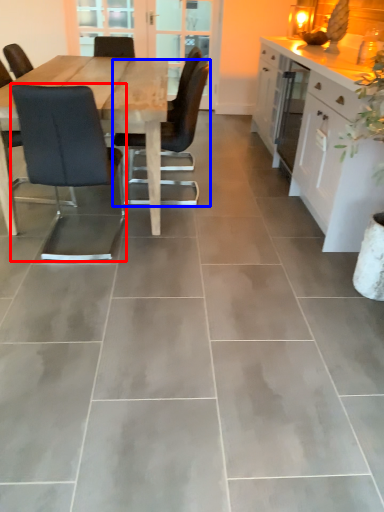
Question: Which object is closer to the camera taking this photo, chair (highlighted by a red box) or chair (highlighted by a blue box)?

Choices:
 (A) chair
 (B) chair

Answer: (A)